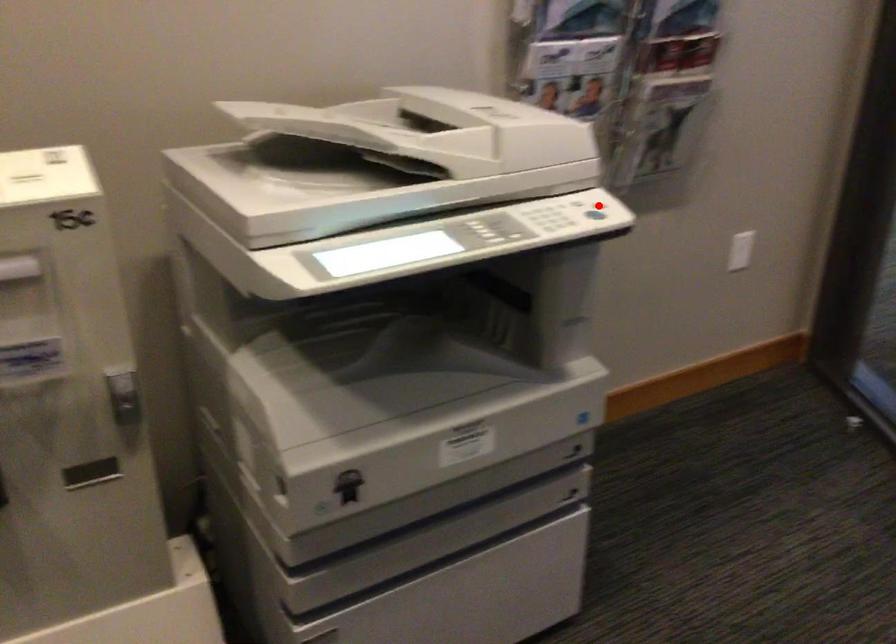
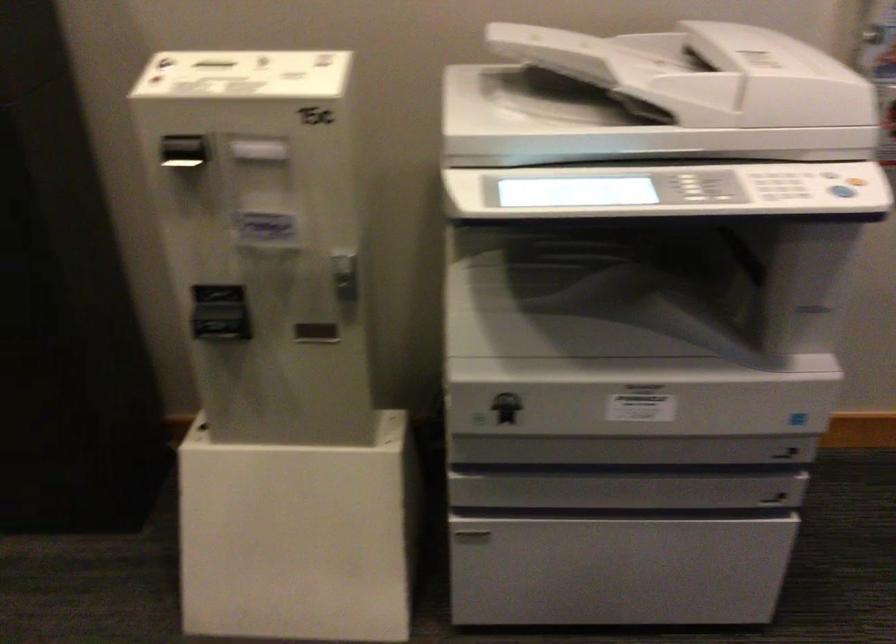
Question: I am providing you with two images of the same scene from different viewpoints. A red point is marked on the first image. Can you still see the location of the red point in image 2?

Choices:
 (A) Yes
 (B) No

Answer: (A)